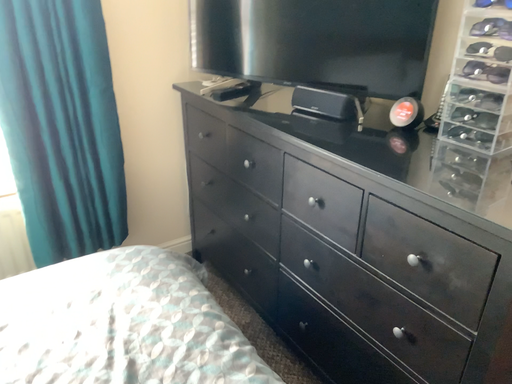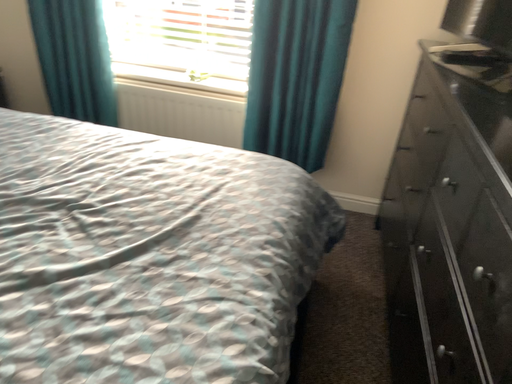
Question: How did the camera likely rotate when shooting the video?

Choices:
 (A) rotated left
 (B) rotated right

Answer: (A)